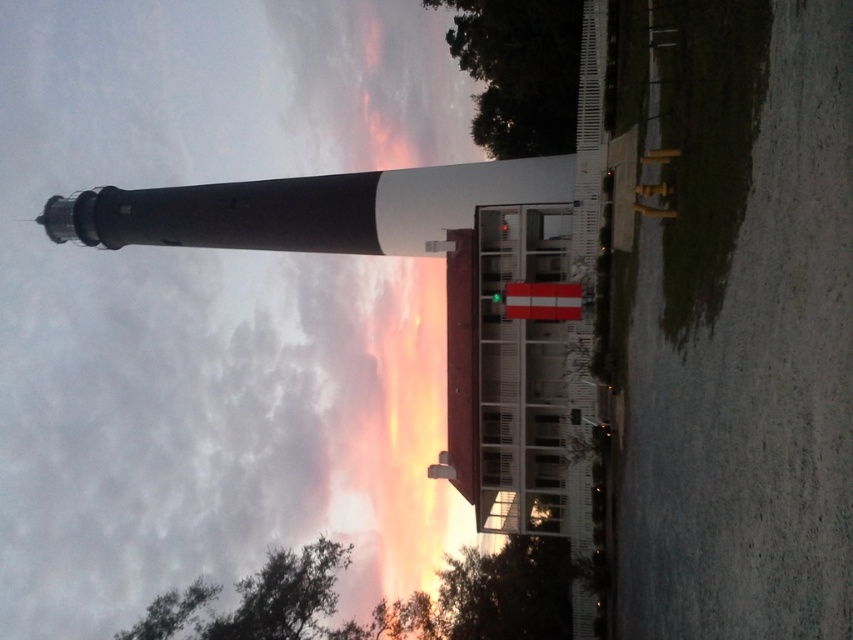
Question: Can you confirm if cloudy sky at upper center is positioned to the right of smooth black lighthouse at left?

Choices:
 (A) no
 (B) yes

Answer: (A)

Question: Which object appears farthest from the camera in this image?

Choices:
 (A) cloudy sky at upper center
 (B) smooth black lighthouse at left

Answer: (A)

Question: Does cloudy sky at upper center have a larger size compared to smooth black lighthouse at left?

Choices:
 (A) yes
 (B) no

Answer: (A)

Question: Which point is closer to the camera taking this photo?

Choices:
 (A) (314, 461)
 (B) (496, 192)

Answer: (B)

Question: Can you confirm if cloudy sky at upper center is positioned to the left of smooth black lighthouse at left?

Choices:
 (A) no
 (B) yes

Answer: (B)